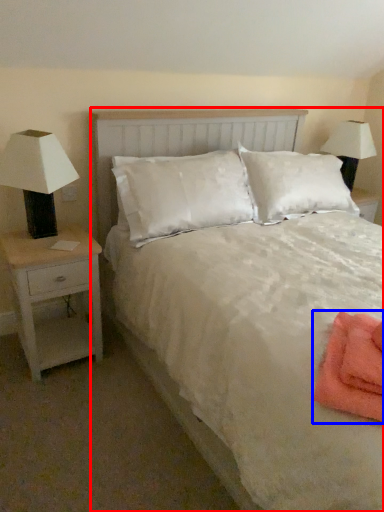
Question: Which object appears closest to the camera in this image, bed (highlighted by a red box) or material (highlighted by a blue box)?

Choices:
 (A) bed
 (B) material

Answer: (A)